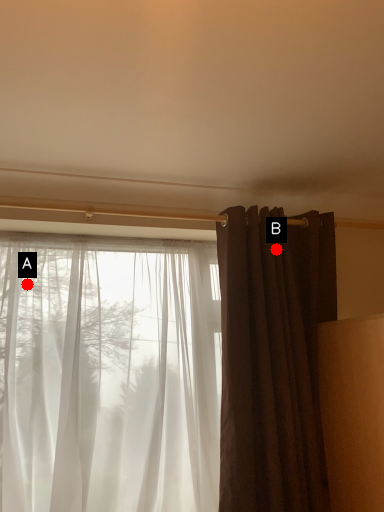
Question: Two points are circled on the image, labeled by A and B beside each circle. Which point appears farthest from the camera in this image?

Choices:
 (A) A is further
 (B) B is further

Answer: (B)